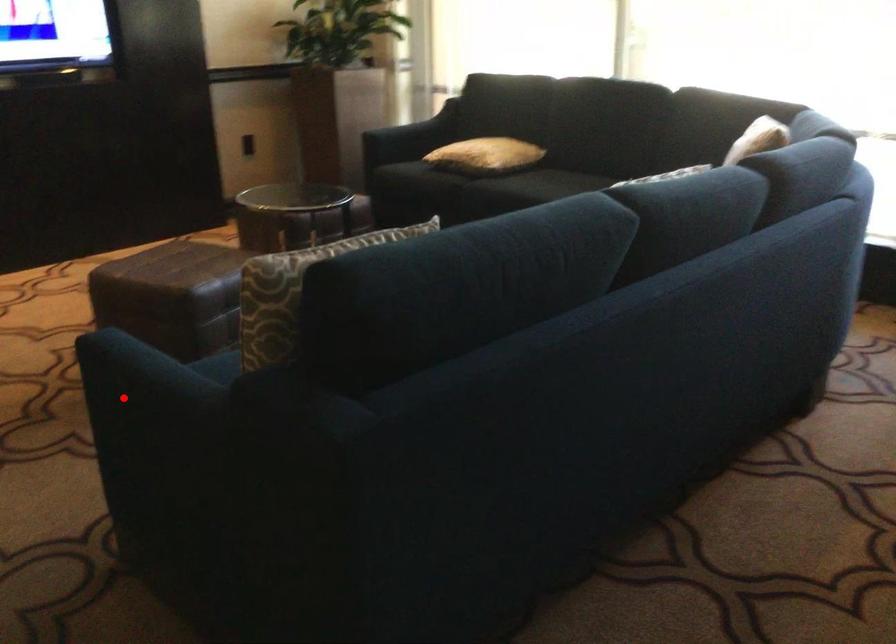
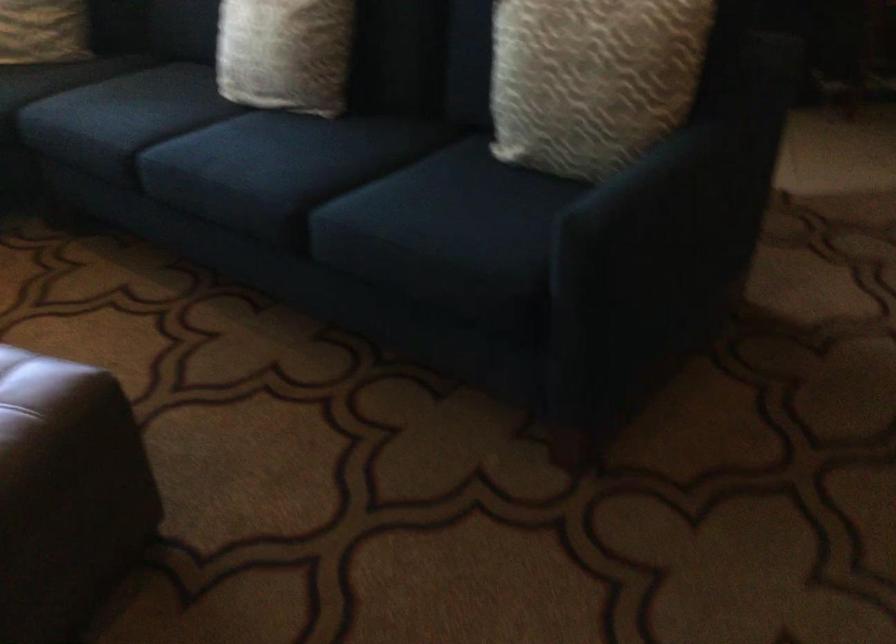
Question: I am providing you with two images of the same scene from different viewpoints. A red point is marked on the first image. Can you still see the location of the red point in image 2?

Choices:
 (A) Yes
 (B) No

Answer: (A)